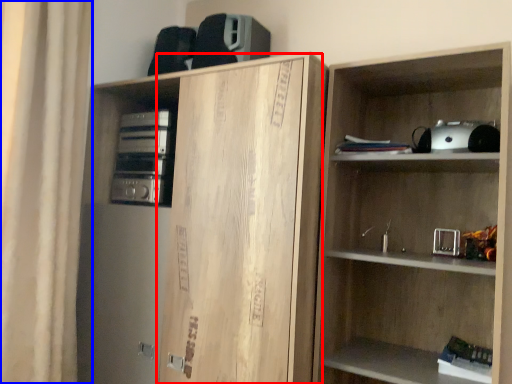
Question: Which object appears farthest to the camera in this image, cabinetry (highlighted by a red box) or curtain (highlighted by a blue box)?

Choices:
 (A) cabinetry
 (B) curtain

Answer: (B)